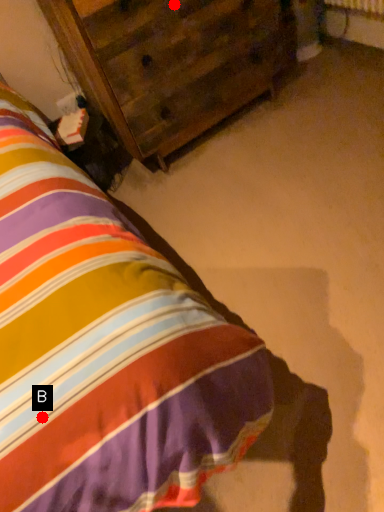
Question: Two points are circled on the image, labeled by A and B beside each circle. Among these points, which one is farthest from the camera?

Choices:
 (A) A is further
 (B) B is further

Answer: (A)